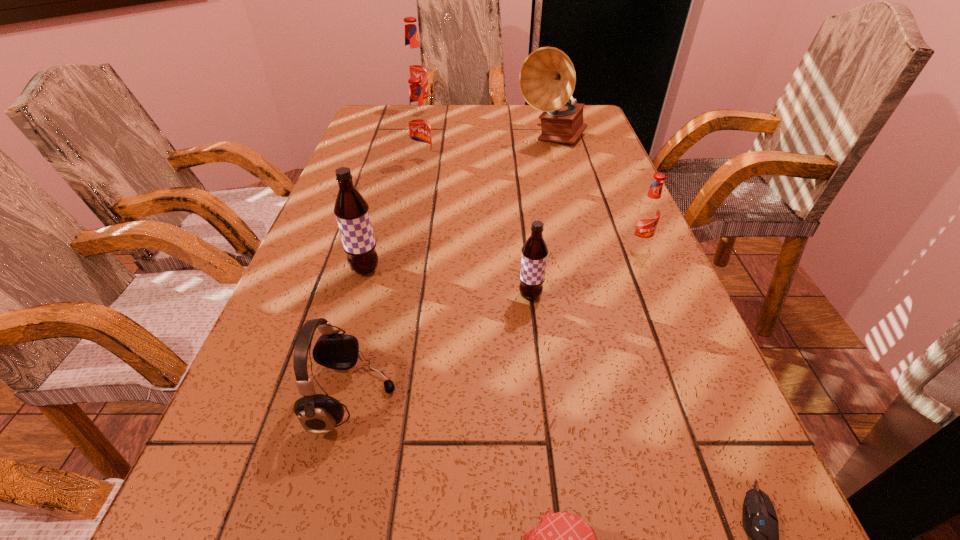
Identify the location of the farthest object. (414, 65).

The width and height of the screenshot is (960, 540). I want to click on the biggest red root beer, so click(x=414, y=65).

The image size is (960, 540). In order to click on the eighth nearest object in this screenshot , I will do `click(547, 78)`.

Image resolution: width=960 pixels, height=540 pixels. Find the location of `the second farthest red root beer`. the second farthest red root beer is located at coordinates (418, 123).

Locate an element on the screen. the second smallest red root beer is located at coordinates (418, 123).

Identify the location of the farther brown root beer. The height and width of the screenshot is (540, 960). (351, 210).

Where is `the bigger brown root beer`? Image resolution: width=960 pixels, height=540 pixels. the bigger brown root beer is located at coordinates (351, 210).

You are a GUI agent. You are given a task and a screenshot of the screen. Output one action in this format:
    pyautogui.click(x=<x>, y=<y>)
    Task: Click on the smaller brown root beer
    The height and width of the screenshot is (540, 960).
    Given the screenshot: What is the action you would take?
    pyautogui.click(x=534, y=251)

Identify the location of the right brown root beer. (534, 251).

Locate an element on the screen. the nearest red root beer is located at coordinates (648, 213).